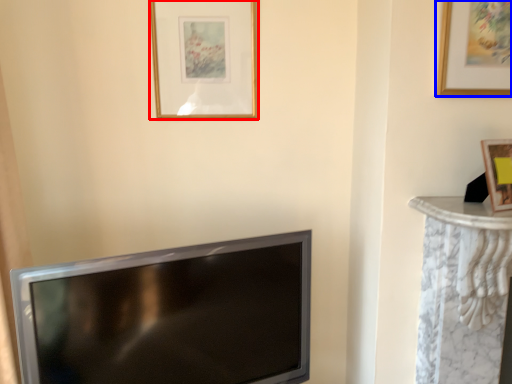
Question: Among these objects, which one is nearest to the camera, picture frame (highlighted by a red box) or picture frame (highlighted by a blue box)?

Choices:
 (A) picture frame
 (B) picture frame

Answer: (B)